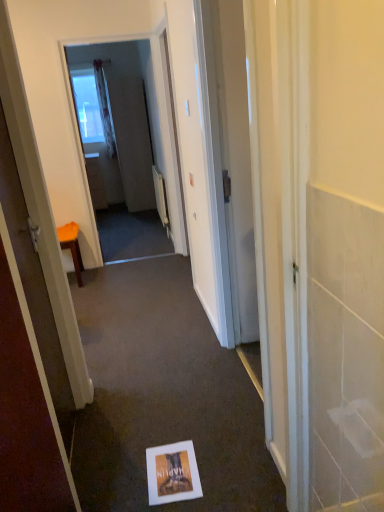
At what (x,y) coordinates should I click in order to perform the action: click on vacant area on top of matte white screen door at upper center, the 1th screen door from the front (from a real-world perspective). Please return your answer as a coordinate pair (x, y). This screenshot has width=384, height=512. Looking at the image, I should click on (101, 31).